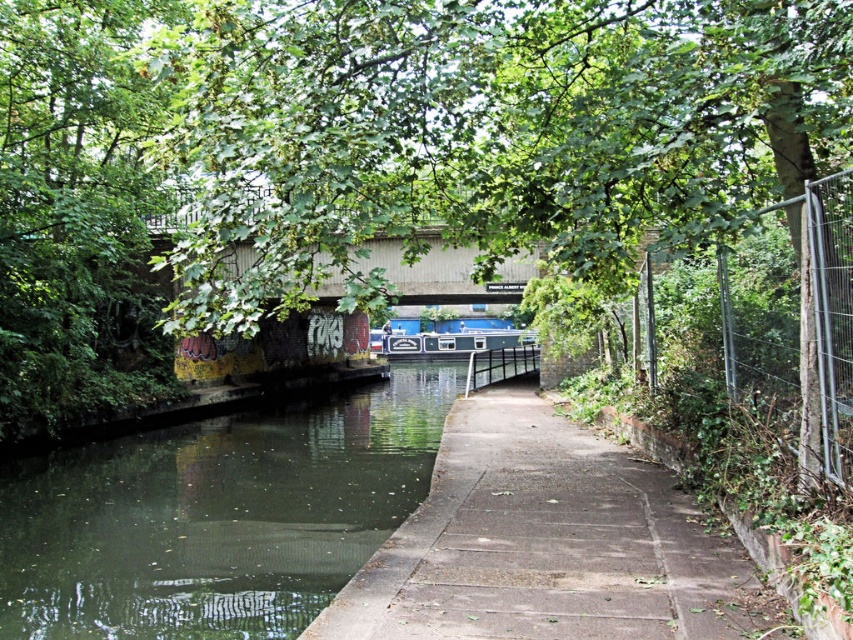
You are a delivery person needing to transport a package from the green concrete river at center to the blue glossy canal boat at center. Given that your vehicle can only travel on the paved path and the bridge, what is the minimum distance you must travel between these two points?

The minimum distance you must travel between the green concrete river at center and the blue glossy canal boat at center is 33.91 meters, as they are 33.91 meters apart from each other.

You are standing at the starting point of the towpath and want to cross the canal using the bridge. According to the coordinates provided in the scene description, where is the green concrete river at center located in relation to the bridge?

The green concrete river at center is located at coordinates point (216, 516), which places it near the bridge spanning the canal in the midground.

You are a photographer standing on the towpath and want to capture the blue glossy canal boat at center without the metallic wire fence at right appearing in the foreground. Is there a way to adjust your position to achieve this?

The metallic wire fence at right is above the blue glossy canal boat at center, so if you move to a lower position or angle your camera downward, you can avoid capturing the fence in the foreground while focusing on the boat.